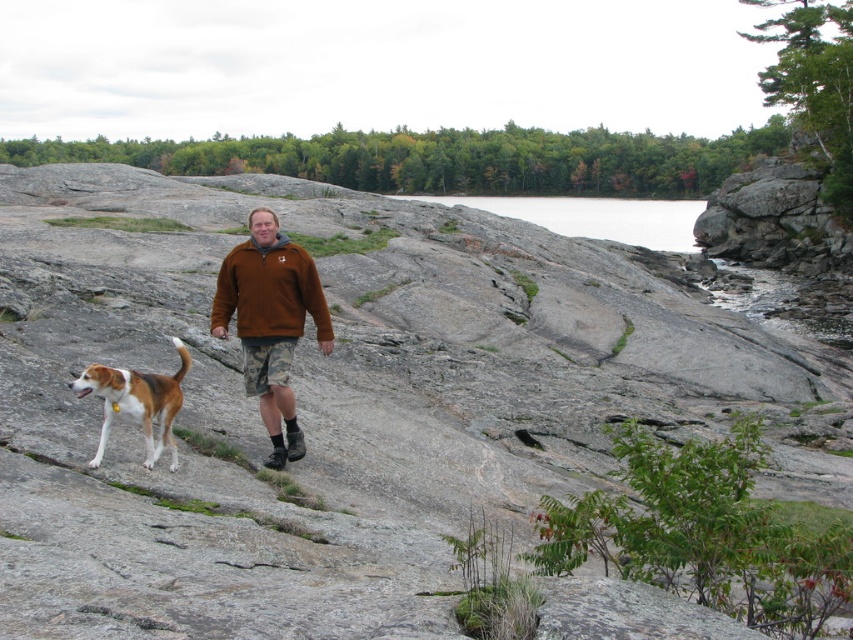
Question: Is the position of brown fleece jacket at center more distant than that of transparent water at upper center?

Choices:
 (A) no
 (B) yes

Answer: (A)

Question: Is transparent water at upper center further to camera compared to tri-color fur dog at lower left?

Choices:
 (A) yes
 (B) no

Answer: (A)

Question: Which object appears closest to the camera in this image?

Choices:
 (A) brown fleece jacket at center
 (B) transparent water at upper center

Answer: (A)

Question: Can you confirm if brown fleece jacket at center is positioned to the right of tri-color fur dog at lower left?

Choices:
 (A) no
 (B) yes

Answer: (B)

Question: Which of these objects is positioned farthest from the tri-color fur dog at lower left?

Choices:
 (A) brown fleece jacket at center
 (B) transparent water at upper center

Answer: (B)

Question: Which object is the farthest from the transparent water at upper center?

Choices:
 (A) tri-color fur dog at lower left
 (B) brown fleece jacket at center

Answer: (B)